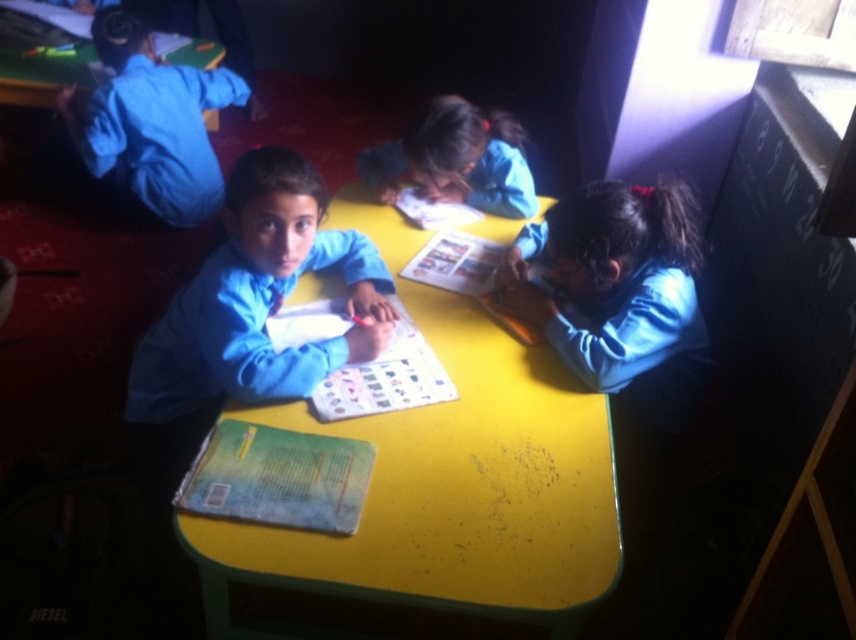
You are a teacher observing the classroom scene. You notice two students wearing blue uniforms. One is wearing a matte blue uniform at lower right and the other a blue uniform shirt at upper left. From your perspective, which student is positioned to the right of the other?

The matte blue uniform at lower right is positioned to the right of the blue uniform shirt at upper left.

You are standing in the classroom and need to place a new desk. The current yellow matte table at center is at coordinates point 0.795, 0.513. If the new desk must be placed 0.3 meters to the left of the existing table, what are the new coordinates for the desk?

The new desk should be placed at coordinates point (x=438, y=316) because subtracting 0.3 meters from the original x coordinate 0.795 gives 0.495 while keeping the y coordinate 0.513 the same.

Based on the photo, you are a teacher observing the classroom scene. You notice the yellow matte table at center and the matte blue uniform at lower right. Which object is closer to the front of the classroom?

The yellow matte table at center is closer to the front of the classroom because it is in front of the matte blue uniform at lower right.